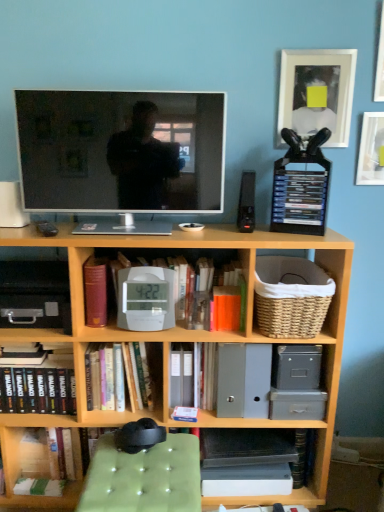
The image size is (384, 512). What are the coordinates of `vacant area on top of wooden bookcase at center (from a real-world perspective)` in the screenshot? It's located at (148, 229).